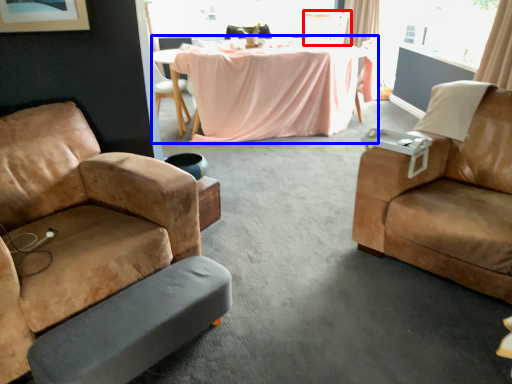
Question: Which object is closer to the camera taking this photo, armchair (highlighted by a red box) or table (highlighted by a blue box)?

Choices:
 (A) armchair
 (B) table

Answer: (B)